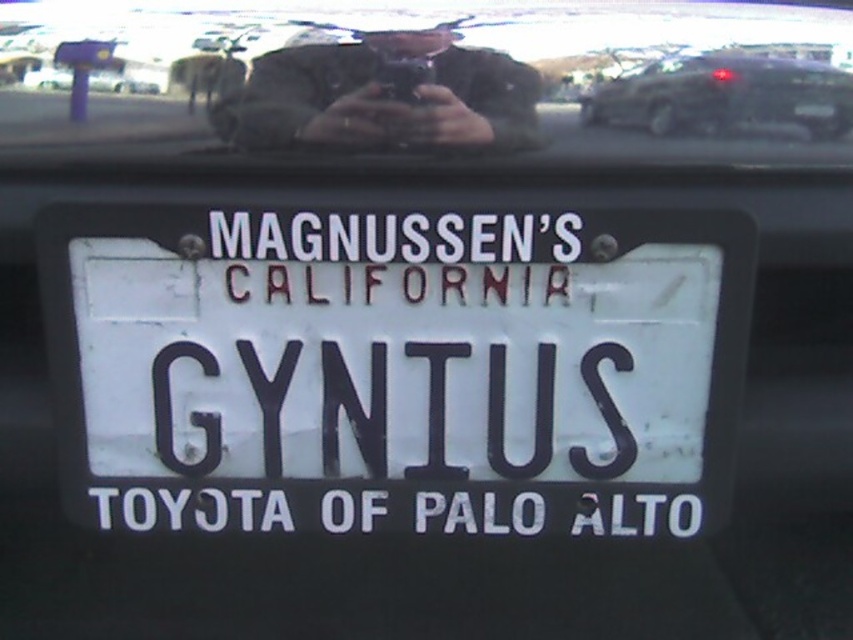
Question: Which of the following is the farthest from the observer?

Choices:
 (A) white matte license plate at center
 (B) metallic dark gray suv at upper right
 (C) matte black phone at upper center

Answer: (B)

Question: Which of these objects is positioned farthest from the metallic dark gray suv at upper right?

Choices:
 (A) matte black phone at upper center
 (B) transparent glass at center

Answer: (A)

Question: Can you confirm if transparent glass at center is positioned to the left of metallic dark gray suv at upper right?

Choices:
 (A) no
 (B) yes

Answer: (B)

Question: Can you confirm if white matte license plate at center is thinner than matte black phone at upper center?

Choices:
 (A) yes
 (B) no

Answer: (B)

Question: Considering the real-world distances, which object is closest to the white matte license plate at center?

Choices:
 (A) matte black phone at upper center
 (B) metallic dark gray suv at upper right

Answer: (A)

Question: Does white matte license plate at center have a greater width compared to matte black phone at upper center?

Choices:
 (A) no
 (B) yes

Answer: (B)